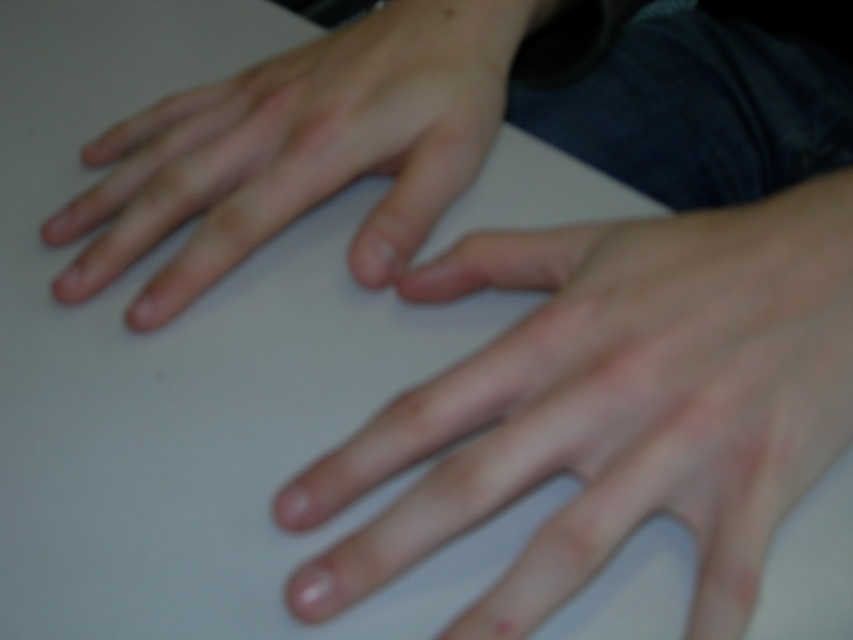
Can you confirm if smooth skin hand at center is thinner than smooth skin hand at upper left?

Indeed, smooth skin hand at center has a lesser width compared to smooth skin hand at upper left.

What do you see at coordinates (612, 404) in the screenshot?
I see `smooth skin hand at center` at bounding box center [612, 404].

Does point (402, 280) come farther from viewer compared to point (425, 12)?

No.

Locate an element on the screen. This screenshot has width=853, height=640. smooth skin hand at center is located at coordinates (612, 404).